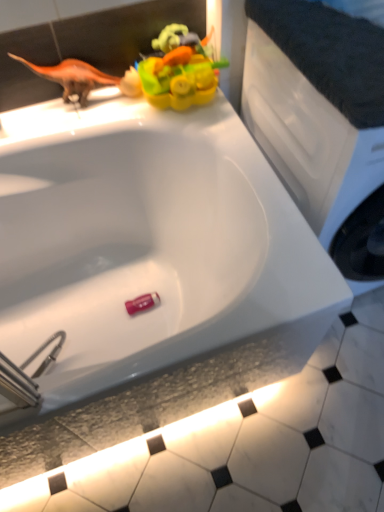
The height and width of the screenshot is (512, 384). Describe the element at coordinates (72, 76) in the screenshot. I see `orange matte dinosaur at upper left` at that location.

Identify the location of orange matte dinosaur at upper left. (72, 76).

Is white matte counter top at upper right shorter than pink plastic eraser at bottom, which appears as the 1th toy when ordered from the bottom?

No.

Can you see white matte counter top at upper right touching pink plastic eraser at bottom, which ranks as the 2th toy in front-to-back order?

They are not placed beside each other.

Is white matte counter top at upper right bigger than pink plastic eraser at bottom, which appears as the 1th toy when ordered from the bottom?

Yes, white matte counter top at upper right is bigger than pink plastic eraser at bottom, which appears as the 1th toy when ordered from the bottom.

Is white matte counter top at upper right further to the viewer compared to pink plastic eraser at bottom, the 1th toy when ordered from back to front?

No.

From a real-world perspective, does white matte counter top at upper right sit lower than white glossy tile at lower center?

No, from a real-world perspective, white matte counter top at upper right is not beneath white glossy tile at lower center.

From the image's perspective, is white matte counter top at upper right beneath white glossy tile at lower center?

No, from the image's perspective, white matte counter top at upper right is not beneath white glossy tile at lower center.

Could you tell me if white matte counter top at upper right is turned towards white glossy tile at lower center?

No, white matte counter top at upper right is not turned towards white glossy tile at lower center.

The height and width of the screenshot is (512, 384). In order to click on counter top that is in front of the white glossy tile at lower center in this screenshot , I will do `click(330, 53)`.

Are rubber duck at upper center, which ranks as the 2th toy in bottom-to-top order, and white matte counter top at upper right far apart?

rubber duck at upper center, which ranks as the 2th toy in bottom-to-top order, is near white matte counter top at upper right, not far away.

Consider the image. Is white matte counter top at upper right completely or partially inside rubber duck at upper center, which ranks as the 2th toy in bottom-to-top order?

That's incorrect, white matte counter top at upper right is not inside rubber duck at upper center, which ranks as the 2th toy in bottom-to-top order.

Identify the location of counter top in front of the rubber duck at upper center, which appears as the first toy when viewed from the front. Image resolution: width=384 pixels, height=512 pixels. (330, 53).

Are white glossy tile at lower center and rubber duck at upper center, which is the second toy in back-to-front order, beside each other?

No, white glossy tile at lower center is not with rubber duck at upper center, which is the second toy in back-to-front order.

From a real-world perspective, is white glossy tile at lower center physically below rubber duck at upper center, which appears as the first toy when viewed from the front?

Yes, from a real-world perspective, white glossy tile at lower center is below rubber duck at upper center, which appears as the first toy when viewed from the front.

Between white glossy tile at lower center and rubber duck at upper center, which ranks as the 2th toy in bottom-to-top order, which one has smaller size?

rubber duck at upper center, which ranks as the 2th toy in bottom-to-top order, is smaller.

Considering the sizes of objects white glossy tile at lower center and rubber duck at upper center, which appears as the first toy when viewed from the front, in the image provided, who is wider, white glossy tile at lower center or rubber duck at upper center, which appears as the first toy when viewed from the front,?

Wider between the two is white glossy tile at lower center.

Can you tell me how much rubber duck at upper center, which ranks as the 2th toy in bottom-to-top order, and pink plastic eraser at bottom, which appears as the 1th toy when ordered from the bottom, differ in facing direction?

The angular difference between rubber duck at upper center, which ranks as the 2th toy in bottom-to-top order, and pink plastic eraser at bottom, which appears as the 1th toy when ordered from the bottom, is 0.000101 degrees.

Locate an element on the screen. toy located on the right of pink plastic eraser at bottom, which ranks as the 2th toy in front-to-back order is located at coordinates (175, 71).

Is rubber duck at upper center, which ranks as the 2th toy in bottom-to-top order, looking in the opposite direction of pink plastic eraser at bottom, which ranks as the 2th toy in front-to-back order?

No, pink plastic eraser at bottom, which ranks as the 2th toy in front-to-back order, is not at the back of rubber duck at upper center, which ranks as the 2th toy in bottom-to-top order.

Considering the positions of objects rubber duck at upper center, which ranks as the 2th toy in bottom-to-top order, and pink plastic eraser at bottom, which appears as the 1th toy when ordered from the bottom, in the image provided, who is in front, rubber duck at upper center, which ranks as the 2th toy in bottom-to-top order, or pink plastic eraser at bottom, which appears as the 1th toy when ordered from the bottom,?

rubber duck at upper center, which ranks as the 2th toy in bottom-to-top order, is more forward.

Is orange matte dinosaur at upper left placed right next to white matte counter top at upper right?

orange matte dinosaur at upper left is not next to white matte counter top at upper right, and they're not touching.

Is orange matte dinosaur at upper left taller or shorter than white matte counter top at upper right?

orange matte dinosaur at upper left is taller than white matte counter top at upper right.

Is orange matte dinosaur at upper left at the left side of white matte counter top at upper right?

Indeed, orange matte dinosaur at upper left is positioned on the left side of white matte counter top at upper right.

From a real-world perspective, which is physically above, orange matte dinosaur at upper left or white matte counter top at upper right?

white matte counter top at upper right.

From the image's perspective, is white glossy tile at lower center located above or below white matte counter top at upper right?

white glossy tile at lower center is situated lower than white matte counter top at upper right in the image.

Is white glossy tile at lower center positioned beyond the bounds of white matte counter top at upper right?

That's correct, white glossy tile at lower center is outside of white matte counter top at upper right.

Are white glossy tile at lower center and white matte counter top at upper right far apart?

No, white glossy tile at lower center is not far away from white matte counter top at upper right.

From a real-world perspective, is white glossy tile at lower center physically located above or below white matte counter top at upper right?

From a real-world perspective, white glossy tile at lower center is physically below white matte counter top at upper right.

Where is `the 2nd toy to the left of the white matte counter top at upper right, counting from the anchor's position`? the 2nd toy to the left of the white matte counter top at upper right, counting from the anchor's position is located at coordinates (142, 303).

Find the location of a particular element. counter top in front of the white glossy tile at lower center is located at coordinates (330, 53).

Estimate the real-world distances between objects in this image. Which object is closer to pink plastic eraser at bottom, which ranks as the 2th toy in front-to-back order, white matte counter top at upper right or rubber duck at upper center, which ranks as the 2th toy in bottom-to-top order?

rubber duck at upper center, which ranks as the 2th toy in bottom-to-top order, is closer to pink plastic eraser at bottom, which ranks as the 2th toy in front-to-back order.

When comparing their distances from white glossy tile at lower center, does white matte counter top at upper right or orange matte dinosaur at upper left seem further?

orange matte dinosaur at upper left is further to white glossy tile at lower center.

Considering their positions, is white glossy tile at lower center positioned closer to rubber duck at upper center, which ranks as the 2th toy in bottom-to-top order, than white matte counter top at upper right?

The object closer to rubber duck at upper center, which ranks as the 2th toy in bottom-to-top order, is white matte counter top at upper right.

Which object lies nearer to the anchor point rubber duck at upper center, which is the 1th toy from top to bottom, orange matte dinosaur at upper left or white glossy tile at lower center?

orange matte dinosaur at upper left is closer to rubber duck at upper center, which is the 1th toy from top to bottom.

Considering their positions, is white glossy tile at lower center positioned closer to rubber duck at upper center, which is the 1th toy from top to bottom, than pink plastic eraser at bottom, acting as the second toy starting from the top?

pink plastic eraser at bottom, acting as the second toy starting from the top, lies closer to rubber duck at upper center, which is the 1th toy from top to bottom, than the other object.

Based on their spatial positions, is white matte counter top at upper right or pink plastic eraser at bottom, which appears as the 1th toy when ordered from the bottom, further from orange matte dinosaur at upper left?

The object further to orange matte dinosaur at upper left is pink plastic eraser at bottom, which appears as the 1th toy when ordered from the bottom.

Based on their spatial positions, is rubber duck at upper center, which appears as the first toy when viewed from the front, or white glossy tile at lower center further from pink plastic eraser at bottom, which ranks as the 2th toy in front-to-back order?

rubber duck at upper center, which appears as the first toy when viewed from the front, is positioned further to the anchor pink plastic eraser at bottom, which ranks as the 2th toy in front-to-back order.

Looking at the image, which one is located further to orange matte dinosaur at upper left, white matte counter top at upper right or white glossy tile at lower center?

white glossy tile at lower center is positioned further to the anchor orange matte dinosaur at upper left.

Locate an element on the screen. toy between orange matte dinosaur at upper left and white glossy tile at lower center in the vertical direction is located at coordinates (142, 303).

Locate an element on the screen. The height and width of the screenshot is (512, 384). counter top between orange matte dinosaur at upper left and white glossy tile at lower center vertically is located at coordinates (330, 53).

I want to click on animal between rubber duck at upper center, which is the second toy in back-to-front order, and white glossy tile at lower center, in the vertical direction, so click(72, 76).

Identify the location of counter top that lies between rubber duck at upper center, which appears as the first toy when viewed from the front, and white glossy tile at lower center from top to bottom. The height and width of the screenshot is (512, 384). (330, 53).